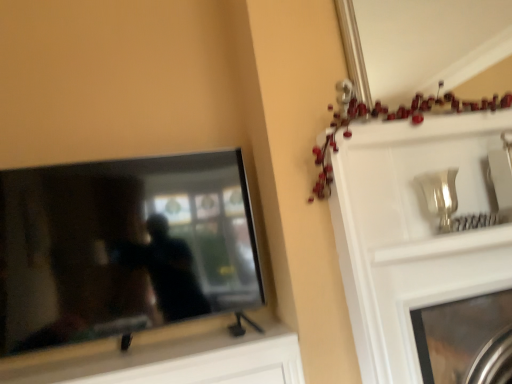
Question: Is metallic silver mirror at upper center oriented away from metallic silver fireplace at upper right?

Choices:
 (A) no
 (B) yes

Answer: (A)

Question: Is metallic silver mirror at upper center bigger than metallic silver fireplace at upper right?

Choices:
 (A) no
 (B) yes

Answer: (A)

Question: From the image's perspective, would you say metallic silver mirror at upper center is shown under metallic silver fireplace at upper right?

Choices:
 (A) no
 (B) yes

Answer: (A)

Question: From a real-world perspective, does metallic silver mirror at upper center sit lower than metallic silver fireplace at upper right?

Choices:
 (A) yes
 (B) no

Answer: (B)

Question: Does metallic silver mirror at upper center have a greater width compared to metallic silver fireplace at upper right?

Choices:
 (A) no
 (B) yes

Answer: (A)

Question: From a real-world perspective, relative to metallic garland at upper right, is matte black tv at left vertically above or below?

Choices:
 (A) above
 (B) below

Answer: (B)

Question: Considering the positions of point (39, 231) and point (346, 81), is point (39, 231) closer or farther from the camera than point (346, 81)?

Choices:
 (A) closer
 (B) farther

Answer: (A)

Question: From their relative heights in the image, would you say matte black tv at left is taller or shorter than metallic garland at upper right?

Choices:
 (A) tall
 (B) short

Answer: (A)

Question: In terms of size, does matte black tv at left appear bigger or smaller than metallic garland at upper right?

Choices:
 (A) big
 (B) small

Answer: (A)

Question: From a real-world perspective, is metallic garland at upper right above or below matte black tv at left?

Choices:
 (A) above
 (B) below

Answer: (A)

Question: Considering their positions, is metallic garland at upper right located in front of or behind matte black tv at left?

Choices:
 (A) behind
 (B) front

Answer: (B)

Question: Does point (392, 112) appear closer or farther from the camera than point (62, 193)?

Choices:
 (A) farther
 (B) closer

Answer: (B)

Question: Considering the positions of metallic garland at upper right and matte black tv at left in the image, is metallic garland at upper right bigger or smaller than matte black tv at left?

Choices:
 (A) small
 (B) big

Answer: (A)

Question: Do you think matte black tv at left is within metallic silver fireplace at upper right, or outside of it?

Choices:
 (A) outside
 (B) inside

Answer: (A)

Question: Is point (41, 279) closer or farther from the camera than point (463, 374)?

Choices:
 (A) closer
 (B) farther

Answer: (B)